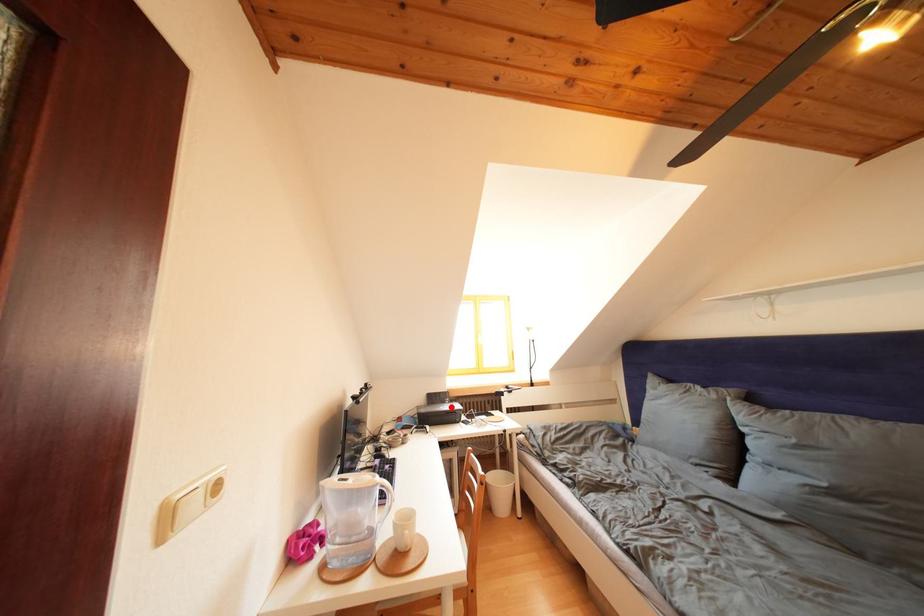
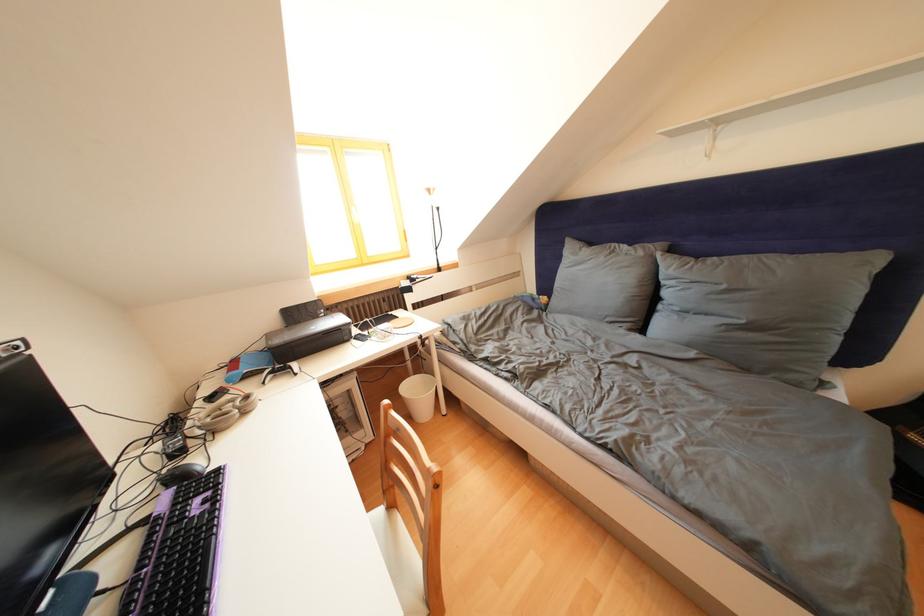
Where in the second image is the point corresponding to the highlighted location from the first image?

(323, 322)